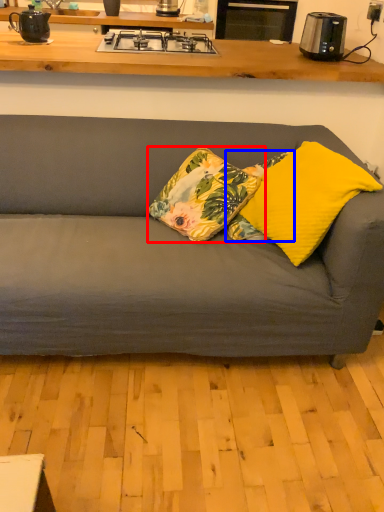
Question: Which point is closer to the camera, pillow (highlighted by a red box) or pillow (highlighted by a blue box)?

Choices:
 (A) pillow
 (B) pillow

Answer: (A)